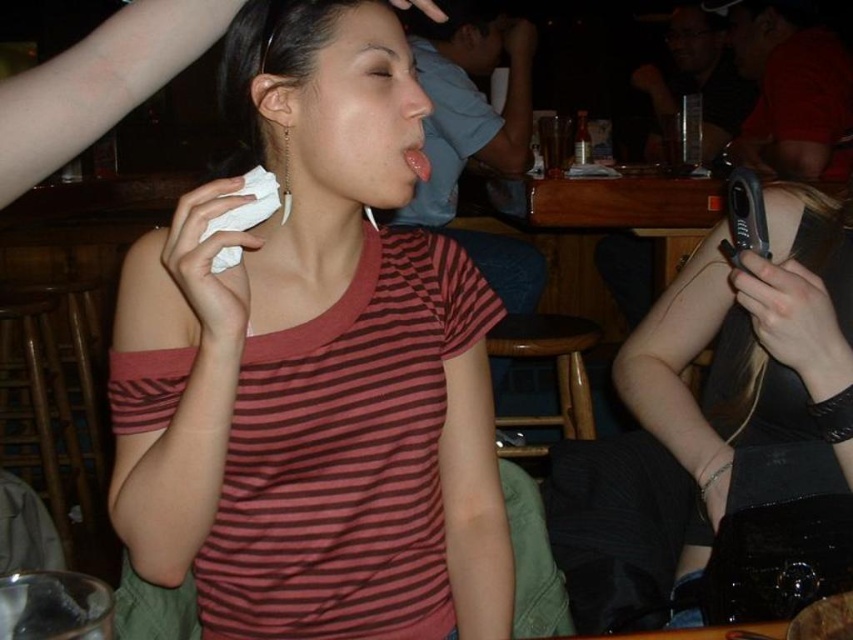
I want to click on black matte phone at right, so click(x=793, y=317).

From the picture: Can you confirm if black matte phone at right is thinner than pink glossy tongue at center?

In fact, black matte phone at right might be wider than pink glossy tongue at center.

Is point (805, 272) closer to viewer compared to point (428, 168)?

Yes, it is.

Find the location of a particular element. This screenshot has height=640, width=853. black matte phone at right is located at coordinates (793, 317).

In the scene shown: Is matte skin nose at center below pink glossy tongue at center?

No.

How much distance is there between matte skin nose at center and pink glossy tongue at center?

The distance of matte skin nose at center from pink glossy tongue at center is 2.41 inches.

Identify the location of matte skin nose at center. This screenshot has width=853, height=640. (412, 96).

What are the coordinates of `matte skin nose at center` in the screenshot? It's located at (412, 96).

Is point (215, 625) closer to camera compared to point (428, 172)?

That is True.

Is striped cotton shirt at center below pink glossy tongue at center?

Yes, striped cotton shirt at center is below pink glossy tongue at center.

This screenshot has height=640, width=853. What are the coordinates of `striped cotton shirt at center` in the screenshot? It's located at (315, 372).